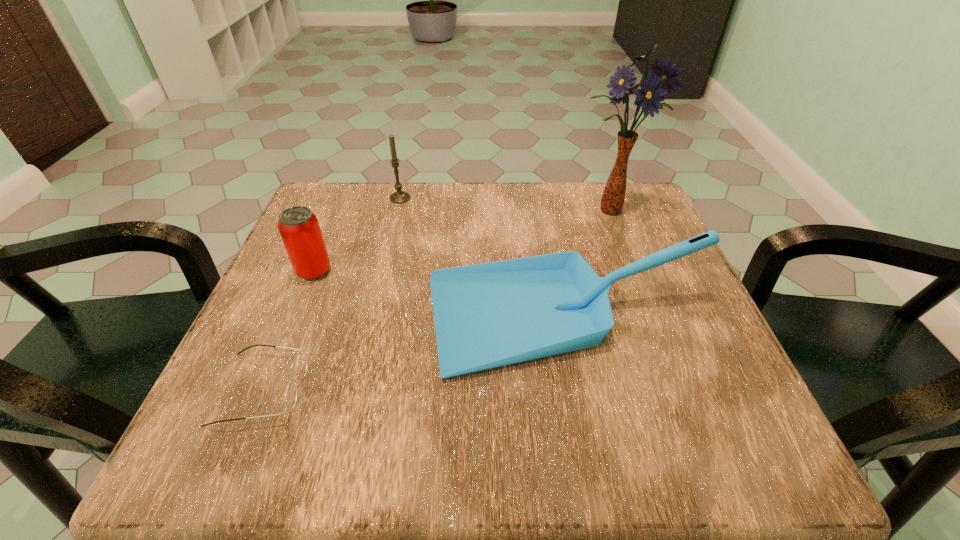
You are a GUI agent. You are given a task and a screenshot of the screen. Output one action in this format:
    pyautogui.click(x=<x>, y=<y>)
    Task: Click on the vacant area at the left edge
    The image size is (960, 540).
    Given the screenshot: What is the action you would take?
    pyautogui.click(x=292, y=270)

Find the location of a particular element. free space at the right edge of the desktop is located at coordinates (699, 371).

Find the location of a particular element. This screenshot has height=540, width=960. free spot at the far left corner of the desktop is located at coordinates (330, 191).

Where is `vacant space at the near left corner of the desktop`? vacant space at the near left corner of the desktop is located at coordinates (184, 467).

Where is `vacant area at the far right corner`? Image resolution: width=960 pixels, height=540 pixels. vacant area at the far right corner is located at coordinates (632, 198).

Where is `empty space that is in between the can and the shortest object`? Image resolution: width=960 pixels, height=540 pixels. empty space that is in between the can and the shortest object is located at coordinates (288, 330).

Locate an element on the screen. free space between the third object from left to right and the dustpan is located at coordinates (483, 259).

The height and width of the screenshot is (540, 960). I want to click on free space that is in between the can and the spectacles, so click(288, 330).

The height and width of the screenshot is (540, 960). In order to click on free space between the can and the candle in this screenshot , I will do `click(357, 234)`.

Find the location of `blank region between the dustpan and the candle`. blank region between the dustpan and the candle is located at coordinates (483, 259).